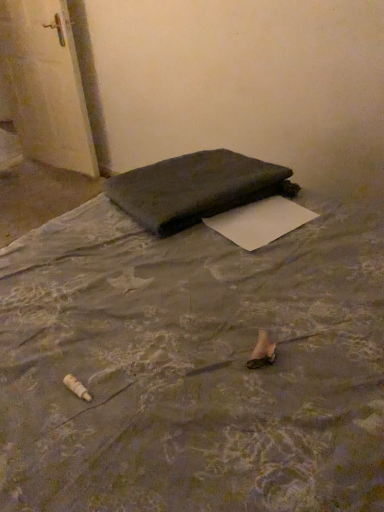
Locate an element on the screen. The image size is (384, 512). vacant space situated above white paper at center (from a real-world perspective) is located at coordinates (262, 217).